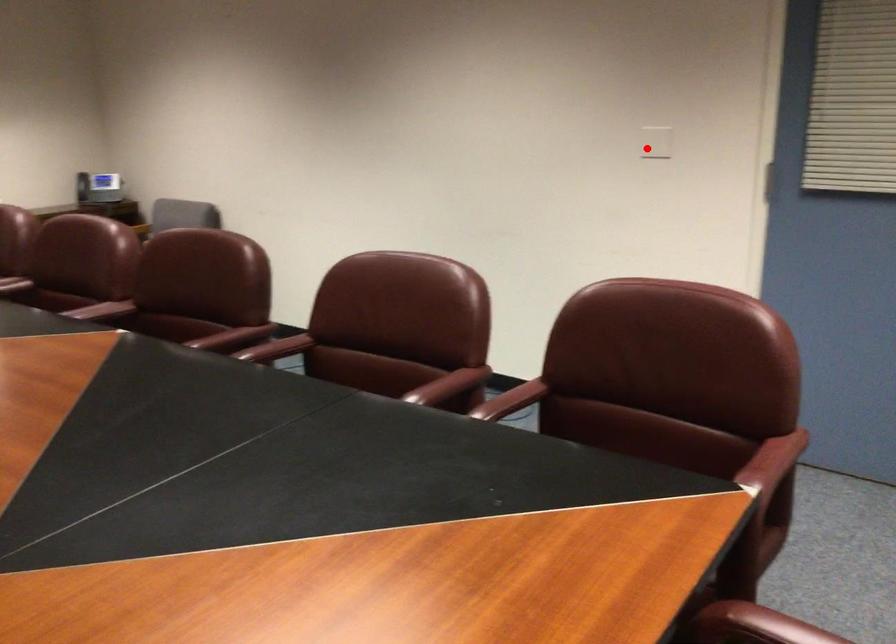
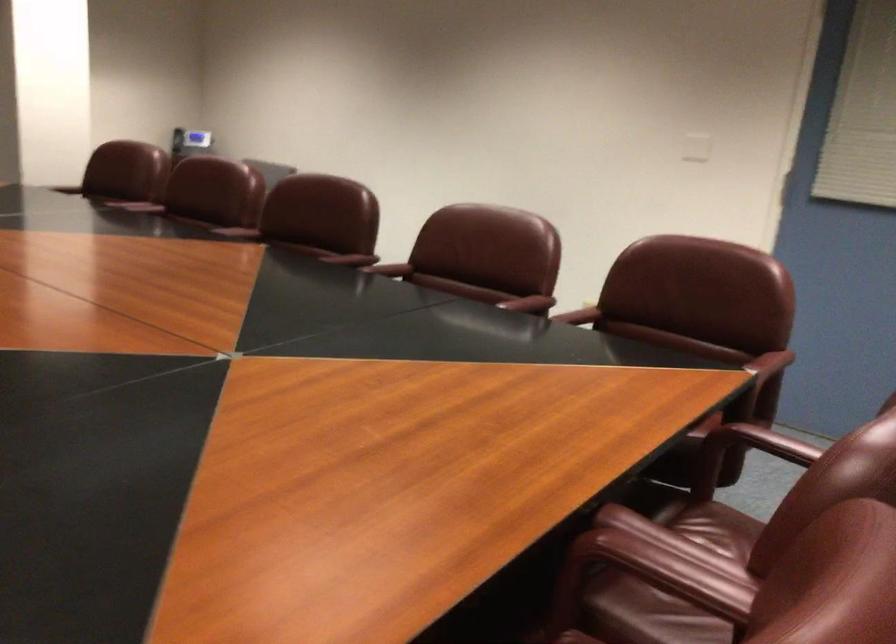
Question: I am providing you with two images of the same scene from different viewpoints. Image1 has a red point marked. In image2, the corresponding 3D location appears at what relative position? Reply with the corresponding letter.

Choices:
 (A) Closer
 (B) Farther

Answer: (B)